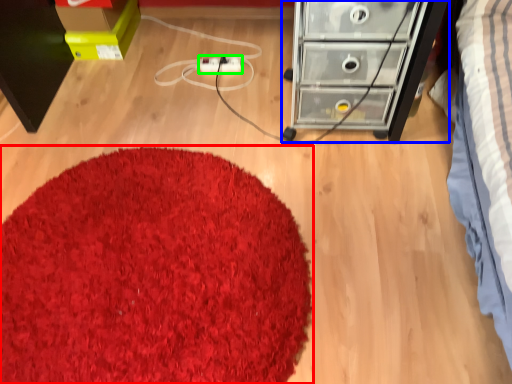
Question: Considering the real-world distances, which object is farthest from mat (highlighted by a red box)? chest of drawers (highlighted by a blue box) or extension cord (highlighted by a green box)?

Choices:
 (A) chest of drawers
 (B) extension cord

Answer: (B)